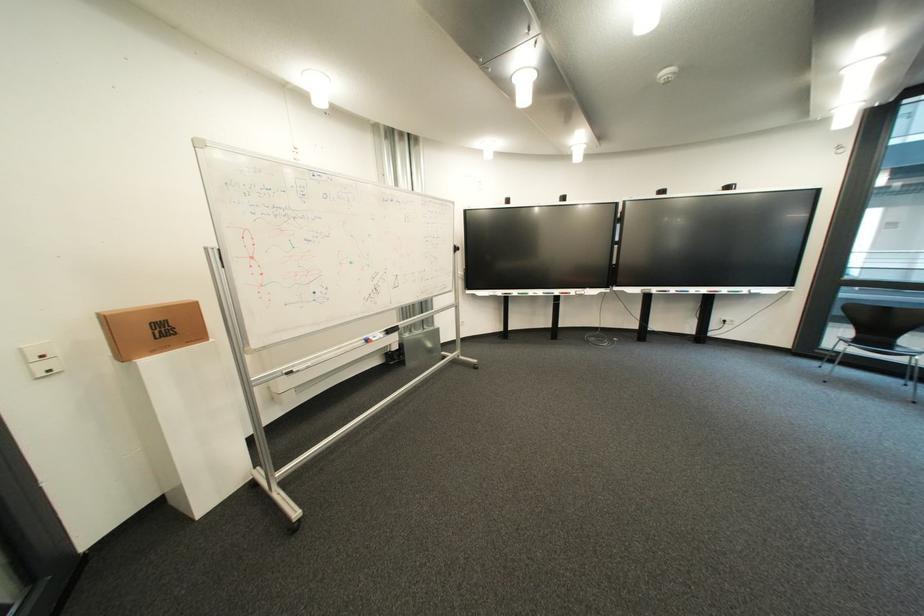
Find where to lift the cardboard box. Please return your answer as a coordinate pair (x, y).

(152, 329)